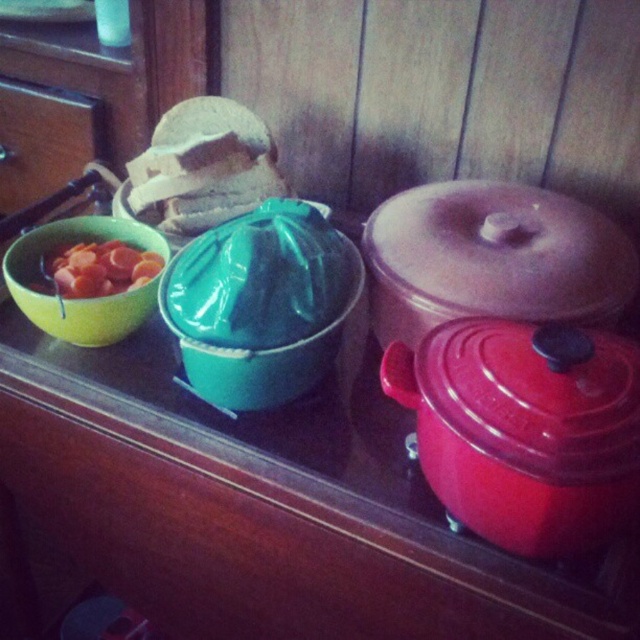
You are a chef preparing ingredients and need to move a cutting board from the matte green bowl at left to the matte green juicer at center. The cutting board is 18 centimeters long. Will it fit diagonally between them?

The distance between the matte green juicer at center and the matte green bowl at left is 17.80 centimeters. Since the cutting board is 18 centimeters long, it will not fit diagonally between them as it is slightly longer than the available space.

In the scene shown: You are arranging items on a wooden surface and need to place a new item exactly at the center of the surface. The matte green juicer at center is currently occupying that spot. Can you move it to another location to make space?

The matte green juicer at center is currently at point (x=273, y=349), so yes, you can move it to another location to make space for the new item at the center.